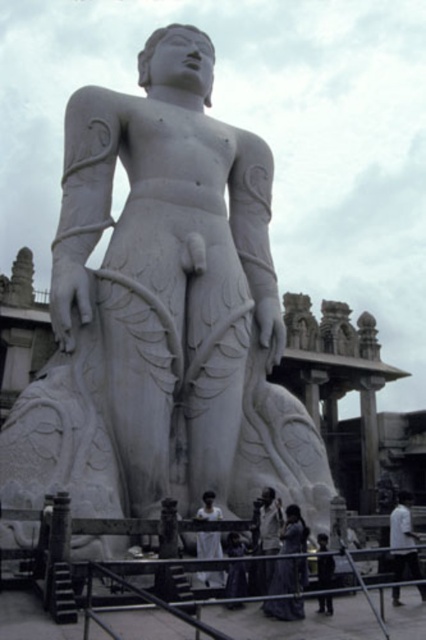
Question: Which point is farther from the camera taking this photo?

Choices:
 (A) (43, 456)
 (B) (242, 579)
 (C) (267, 497)
 (D) (294, 560)

Answer: (C)

Question: Does white marble statue at center appear on the left side of dark gray fabric at lower center?

Choices:
 (A) yes
 (B) no

Answer: (A)

Question: Is silky purple dress at center wider than dark gray fabric at center?

Choices:
 (A) yes
 (B) no

Answer: (A)

Question: From the image, what is the correct spatial relationship of white fabric dress at center in relation to white clothed figure at center?

Choices:
 (A) left
 (B) right

Answer: (B)

Question: Which point is closer to the camera?

Choices:
 (A) white cotton shirt at lower right
 (B) dark gray fabric at center
 (C) dark gray fabric at lower center
 (D) white clothed figure at center

Answer: (A)

Question: Estimate the real-world distances between objects in this image. Which object is closer to the white fabric dress at center?

Choices:
 (A) white clothed figure at center
 (B) dark gray fabric at center
 (C) dark gray fabric at lower center
 (D) white cotton shirt at lower right

Answer: (B)